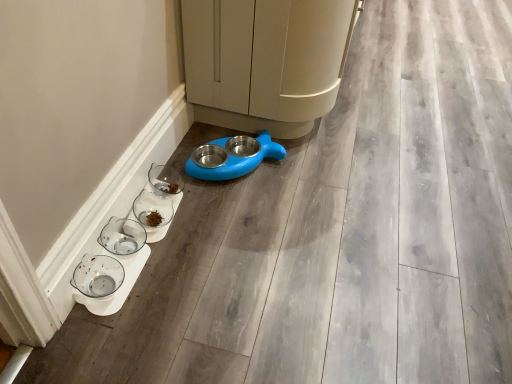
Question: Does clear glass bowl at lower left, the 2th glass bowl viewed from the back, turn towards blue plastic pet feeder at center?

Choices:
 (A) no
 (B) yes

Answer: (A)

Question: Does clear glass bowl at lower left, the 2th glass bowl viewed from the back, appear on the left side of blue plastic pet feeder at center?

Choices:
 (A) yes
 (B) no

Answer: (A)

Question: Does clear glass bowl at lower left, the 2th glass bowl in the front-to-back sequence, appear on the right side of blue plastic pet feeder at center?

Choices:
 (A) yes
 (B) no

Answer: (B)

Question: Is clear glass bowl at lower left, the 2th glass bowl in the front-to-back sequence, closer to camera compared to blue plastic pet feeder at center?

Choices:
 (A) yes
 (B) no

Answer: (A)

Question: Considering the relative sizes of clear glass bowl at lower left, the 2th glass bowl viewed from the back, and blue plastic pet feeder at center in the image provided, is clear glass bowl at lower left, the 2th glass bowl viewed from the back, smaller than blue plastic pet feeder at center?

Choices:
 (A) yes
 (B) no

Answer: (A)

Question: In terms of size, does clear glass bowl at lower center, which is the first glass bowl in back-to-front order, appear bigger or smaller than blue plastic pet feeder at center?

Choices:
 (A) small
 (B) big

Answer: (A)

Question: Is clear glass bowl at lower center, the 3th glass bowl in the front-to-back sequence, taller or shorter than blue plastic pet feeder at center?

Choices:
 (A) tall
 (B) short

Answer: (B)

Question: From the image's perspective, relative to blue plastic pet feeder at center, is clear glass bowl at lower center, which is the first glass bowl in back-to-front order, above or below?

Choices:
 (A) below
 (B) above

Answer: (A)

Question: Is clear glass bowl at lower center, the 3th glass bowl in the front-to-back sequence, situated inside blue plastic pet feeder at center or outside?

Choices:
 (A) inside
 (B) outside

Answer: (B)

Question: From the image's perspective, is transparent glass bowl at lower left, which is counted as the first glass bowl, starting from the front, positioned above or below clear glass bowl at lower center, the 3th glass bowl in the front-to-back sequence?

Choices:
 (A) below
 (B) above

Answer: (A)

Question: In terms of height, does transparent glass bowl at lower left, which is counted as the first glass bowl, starting from the front, look taller or shorter compared to clear glass bowl at lower center, which is the first glass bowl in back-to-front order?

Choices:
 (A) tall
 (B) short

Answer: (A)

Question: Relative to clear glass bowl at lower center, the 3th glass bowl in the front-to-back sequence, is transparent glass bowl at lower left, the third glass bowl when ordered from back to front, in front or behind?

Choices:
 (A) front
 (B) behind

Answer: (A)

Question: Does point (78, 281) appear closer or farther from the camera than point (168, 211)?

Choices:
 (A) closer
 (B) farther

Answer: (A)

Question: Is point (102, 261) positioned closer to the camera than point (342, 41)?

Choices:
 (A) farther
 (B) closer

Answer: (B)

Question: In the image, is transparent glass bowl at lower left, which is counted as the first glass bowl, starting from the front, positioned in front of or behind blue plastic bowl at lower center?

Choices:
 (A) behind
 (B) front

Answer: (B)